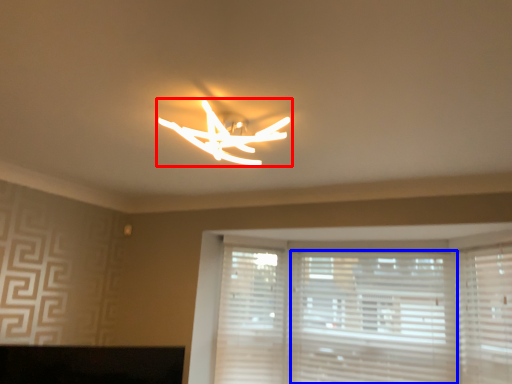
Question: Which object appears farthest to the camera in this image, lamp (highlighted by a red box) or blind (highlighted by a blue box)?

Choices:
 (A) lamp
 (B) blind

Answer: (B)